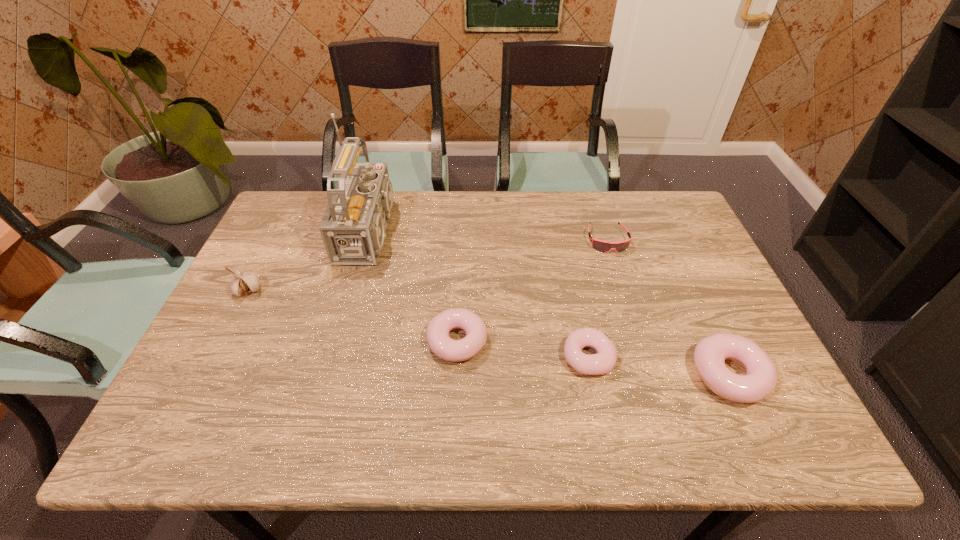
What are the coordinates of `the second closest doughnut relative to the goggles` in the screenshot? It's located at (760, 379).

Locate an element on the screen. This screenshot has height=540, width=960. vacant space that satisfies the following two spatial constraints: 1. on the front-facing side of the rightmost object; 2. on the right side of the second object from left to right is located at coordinates (337, 375).

At what (x,y) coordinates should I click in order to perform the action: click on free space that satisfies the following two spatial constraints: 1. on the front-facing side of the fifth object from left to right; 2. on the left side of the rightmost doughnut. Please return your answer as a coordinate pair (x, y). Looking at the image, I should click on (650, 375).

At what (x,y) coordinates should I click in order to perform the action: click on free location that satisfies the following two spatial constraints: 1. on the front-facing side of the rightmost doughnut; 2. on the left side of the radio receiver. Please return your answer as a coordinate pair (x, y). The width and height of the screenshot is (960, 540). Looking at the image, I should click on (337, 375).